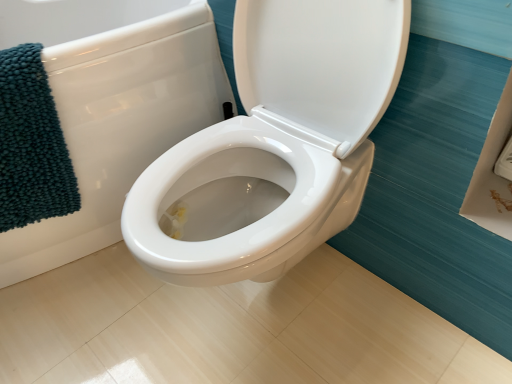
Question: Visually, is white glossy toilet at center positioned to the left or to the right of teal chenille bath towel at left?

Choices:
 (A) right
 (B) left

Answer: (B)

Question: Is white glossy toilet at center wider or thinner than teal chenille bath towel at left?

Choices:
 (A) thin
 (B) wide

Answer: (B)

Question: Considering their positions, is white glossy toilet at center located in front of or behind teal chenille bath towel at left?

Choices:
 (A) front
 (B) behind

Answer: (A)

Question: Is teal chenille bath towel at left inside the boundaries of white glossy toilet at center, or outside?

Choices:
 (A) outside
 (B) inside

Answer: (B)

Question: From their relative heights in the image, would you say teal chenille bath towel at left is taller or shorter than white glossy toilet at center?

Choices:
 (A) tall
 (B) short

Answer: (B)

Question: From the image's perspective, relative to white glossy toilet at center, is teal chenille bath towel at left above or below?

Choices:
 (A) above
 (B) below

Answer: (B)

Question: In the image, is teal chenille bath towel at left positioned in front of or behind white glossy toilet at center?

Choices:
 (A) behind
 (B) front

Answer: (A)